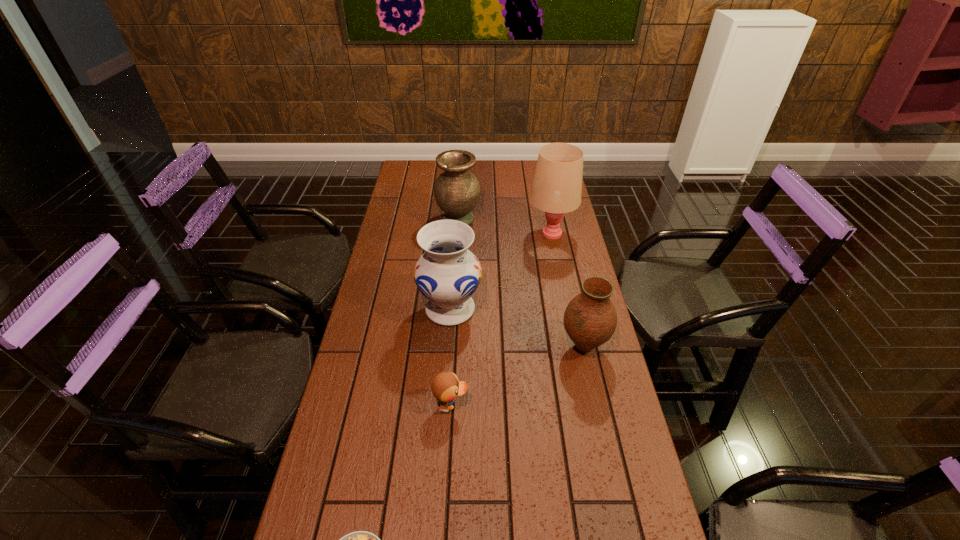
I want to click on lampshade, so click(x=557, y=186).

At what (x,y) coordinates should I click in order to perform the action: click on the farthest vase. Please return your answer as a coordinate pair (x, y). This screenshot has height=540, width=960. Looking at the image, I should click on (457, 191).

This screenshot has height=540, width=960. In order to click on the rightmost vase in this screenshot , I will do `click(590, 319)`.

Locate an element on the screen. This screenshot has width=960, height=540. the fifth tallest object is located at coordinates (445, 386).

Locate an element on the screen. The width and height of the screenshot is (960, 540). the second nearest object is located at coordinates (445, 386).

Where is `vacant space located 0.050m on the front of the lampshade`? The image size is (960, 540). vacant space located 0.050m on the front of the lampshade is located at coordinates (556, 256).

I want to click on free space located 0.270m on the right of the farthest vase, so click(x=545, y=220).

Identify the location of vacant region located 0.240m on the front of the rightmost vase. The height and width of the screenshot is (540, 960). [x=606, y=446].

Identify the location of vacant point located on the front-facing side of the second nearest object. (610, 404).

The image size is (960, 540). Identify the location of lampshade situated at the right edge. (557, 186).